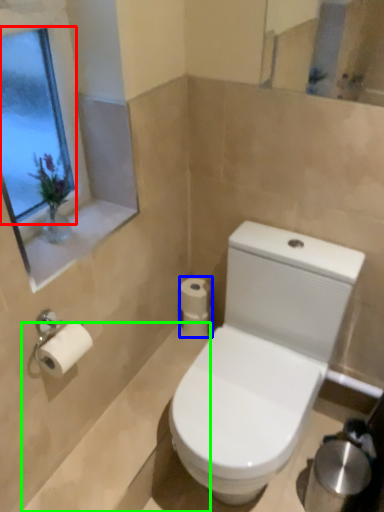
Question: Which is nearer to the window screen (highlighted by a red box)? toilet paper (highlighted by a blue box) or bath (highlighted by a green box).

Choices:
 (A) toilet paper
 (B) bath

Answer: (A)